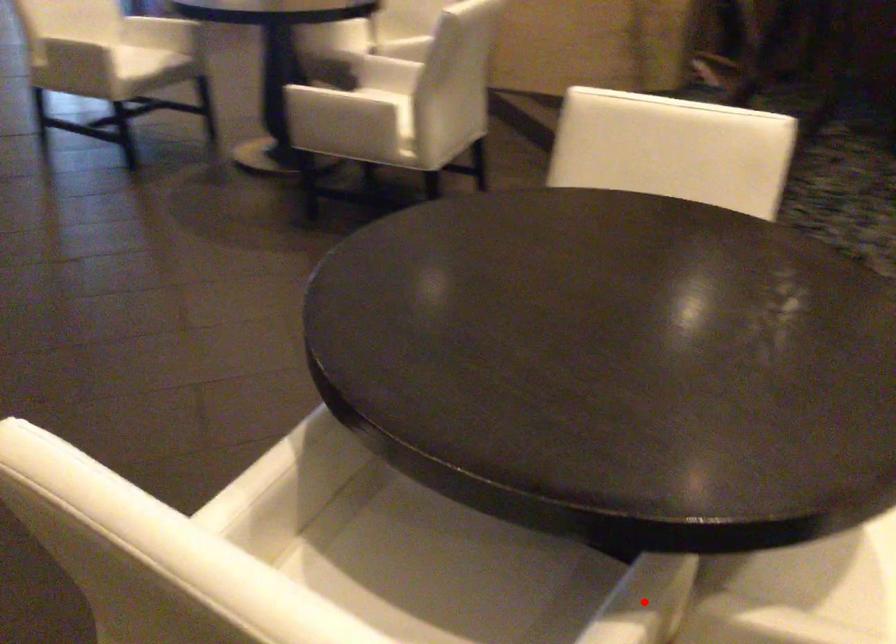
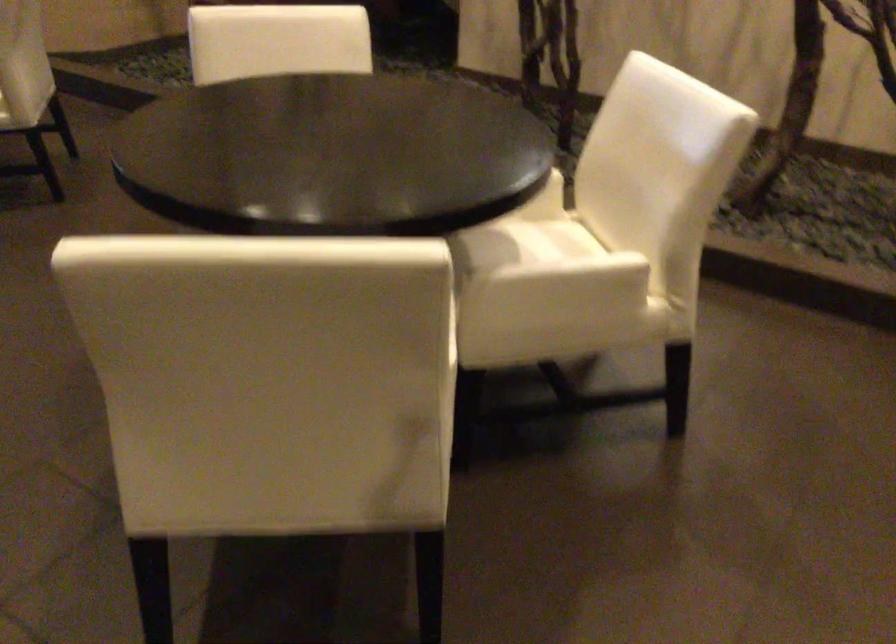
Question: I am providing you with two images of the same scene from different viewpoints. A red point is marked on the first image. Can you still see the location of the red point in image 2?

Choices:
 (A) Yes
 (B) No

Answer: (B)